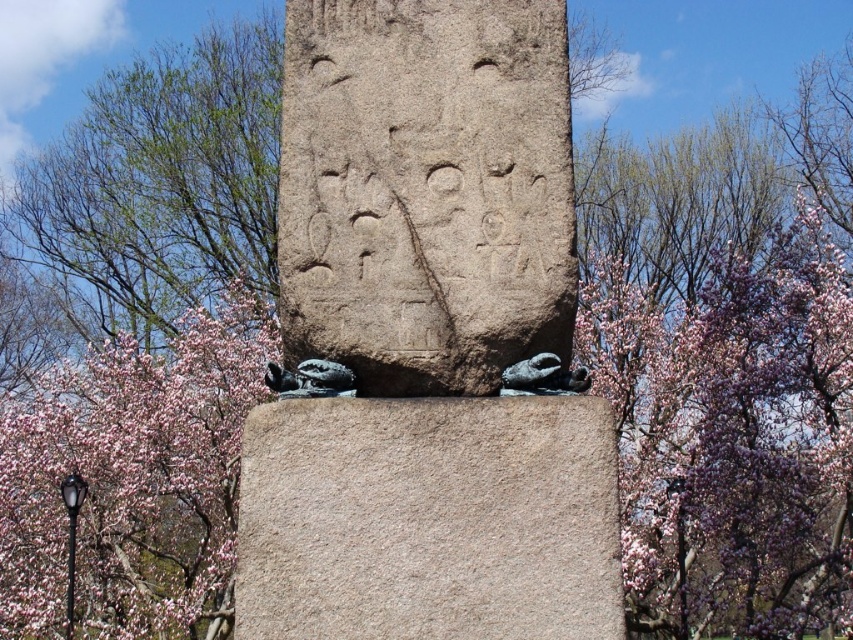
Is gray stone monument at center further to the viewer compared to pink blossoms at upper right?

No, gray stone monument at center is closer to the viewer.

Is gray stone monument at center thinner than pink blossoms at upper right?

Yes.

Is point (387, 22) positioned before point (755, 385)?

Yes, point (387, 22) is in front of point (755, 385).

In order to click on gray stone monument at center in this screenshot , I will do `click(427, 339)`.

Is the position of gray stone monument at center more distant than that of smooth gray stone at center?

Yes.

Can you confirm if gray stone monument at center is positioned to the left of smooth gray stone at center?

Correct, you'll find gray stone monument at center to the left of smooth gray stone at center.

The height and width of the screenshot is (640, 853). What do you see at coordinates (427, 339) in the screenshot?
I see `gray stone monument at center` at bounding box center [427, 339].

Locate an element on the screen. This screenshot has width=853, height=640. gray stone monument at center is located at coordinates (427, 339).

Who is positioned more to the left, pink blossoms at upper right or smooth gray stone at center?

From the viewer's perspective, smooth gray stone at center appears more on the left side.

Is pink blossoms at upper right to the right of smooth gray stone at center from the viewer's perspective?

Indeed, pink blossoms at upper right is positioned on the right side of smooth gray stone at center.

Identify the location of pink blossoms at upper right. The height and width of the screenshot is (640, 853). (732, 436).

Identify the location of pink blossoms at upper right. The height and width of the screenshot is (640, 853). (732, 436).